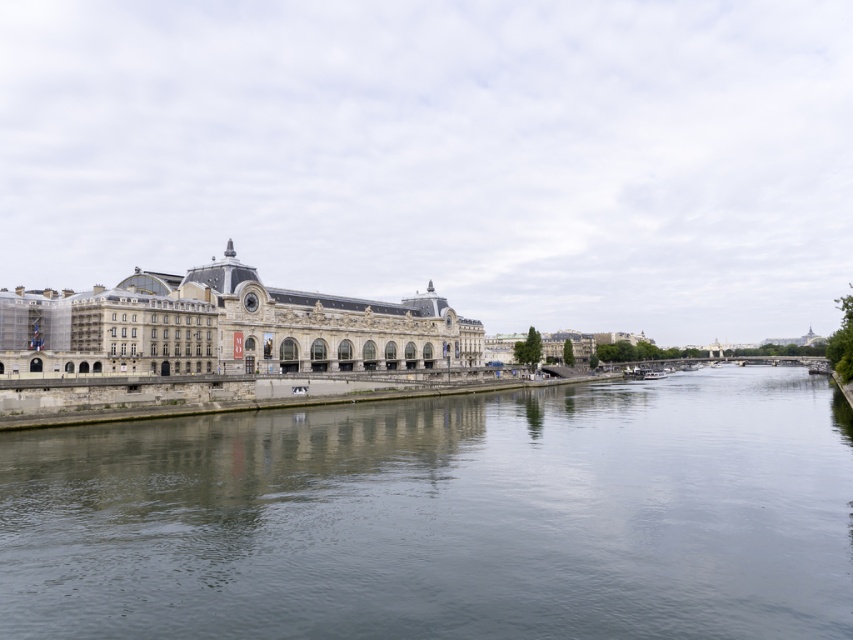
You are standing on the riverside path and want to take a photo of both the smooth gray water at center and the stone building at center. Which object will appear taller in your photo?

The stone building at center will appear taller in the photo because the smooth gray water at center has a lesser height compared to it.

You are a tourist standing at the riverside and want to take a photo of the stone building at center and the smooth gray water at center. Which object should you focus on first if you want to capture both in one frame without moving your camera?

You should focus on the stone building at center first because the smooth gray water at center is positioned to its right, so by centering the building, the water will naturally be included in the frame to its right side.

Based on the photo, you are a photographer planning to capture the stone building at center and the smooth gray water at center in a single frame. Based on the scene, which object occupies more horizontal space in the image?

The smooth gray water at center occupies more horizontal space than the stone building at center because its width surpasses the building.